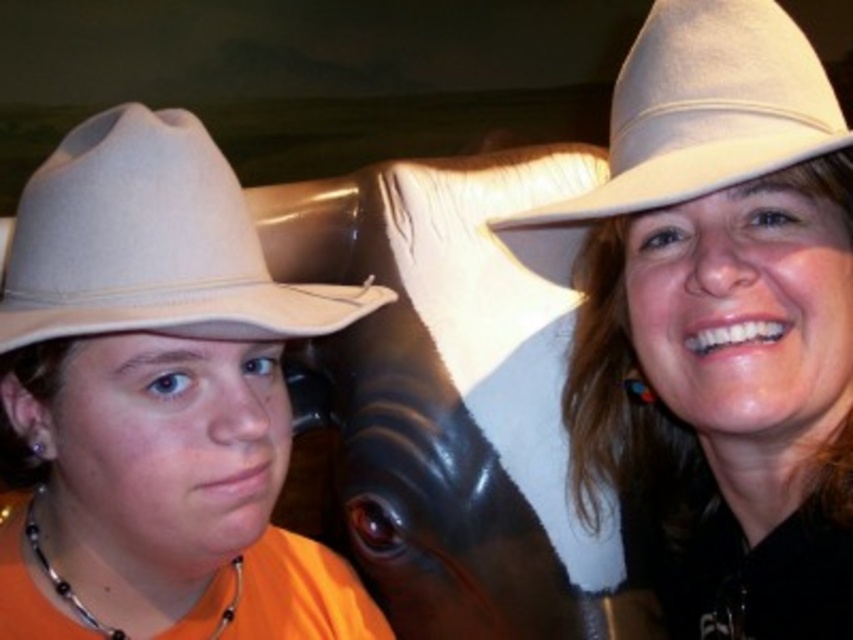
You are a photographer trying to capture a clear shot of both the white felt cowboy hat at upper center and the matte beige cowboy hat at left. Since you want to focus on the one closer to you, which hat should you adjust your camera to focus on?

The white felt cowboy hat at upper center is closer to you, so you should focus your camera on it.

You are standing in front of the sculpture and want to touch the felt cowboy hat at left. Is it within arm reach?

The felt cowboy hat at left is 23.69 inches away from viewer, so yes, it is within arm reach.

You are standing in front of the sculpture and want to place a matte beige cowboy hat at left on the sculpture. Can you determine which part of the sculpture it is currently positioned relative to?

The matte beige cowboy hat at left is located at point (155, 397) on the sculpture, which corresponds to the lower right area of the sculpture. Therefore, it is positioned on the lower right part of the sculpture.